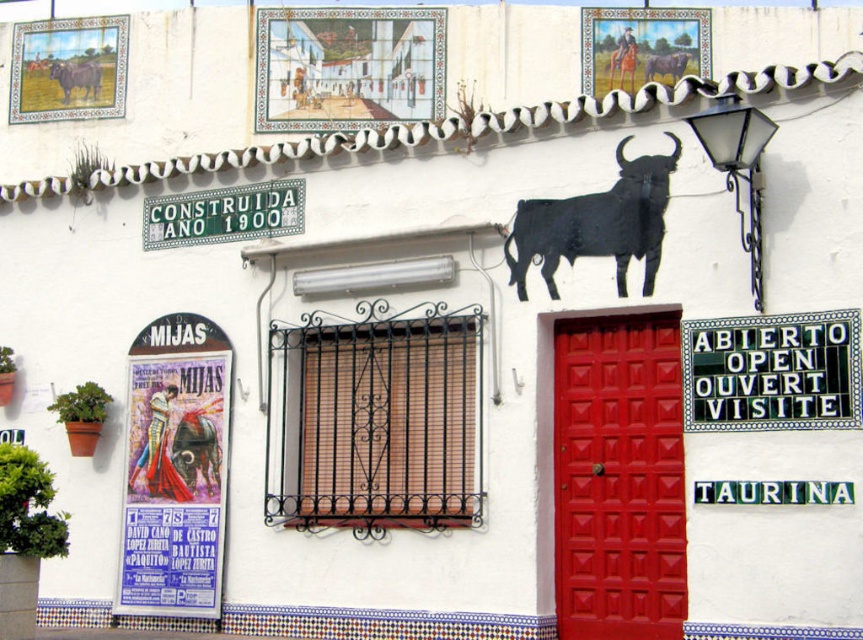
Does glossy wood door at center right appear over black matte bull at center?

No, glossy wood door at center right is not above black matte bull at center.

From the picture: Can you confirm if glossy wood door at center right is wider than black matte bull at center?

No.

Where is `glossy wood door at center right`? glossy wood door at center right is located at coordinates (618, 477).

Does point (851, 344) come behind point (253, 220)?

No, (851, 344) is in front of (253, 220).

Does black tile sign at upper right have a lesser height compared to greenmattesign at upper center?

Incorrect, black tile sign at upper right's height does not fall short of greenmattesign at upper center's.

Which is in front, point (729, 353) or point (147, 196)?

Point (729, 353) is more forward.

Where is `black tile sign at upper right`? The width and height of the screenshot is (863, 640). black tile sign at upper right is located at coordinates (772, 371).

Is greenmattesign at upper center taller than matte black bull at upper left?

Incorrect, greenmattesign at upper center's height is not larger of matte black bull at upper left's.

Who is positioned more to the right, greenmattesign at upper center or matte black bull at upper left?

greenmattesign at upper center is more to the right.

The image size is (863, 640). What do you see at coordinates (224, 214) in the screenshot?
I see `greenmattesign at upper center` at bounding box center [224, 214].

At what (x,y) coordinates should I click in order to perform the action: click on greenmattesign at upper center. Please return your answer as a coordinate pair (x, y). Looking at the image, I should click on (224, 214).